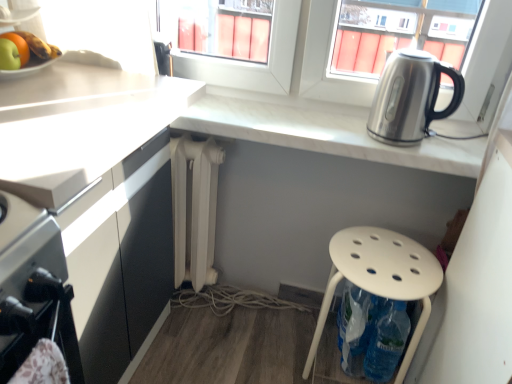
Question: Is the depth of white plastic stool at lower right less than that of green matte apple at upper left?

Choices:
 (A) yes
 (B) no

Answer: (B)

Question: Considering the relative sizes of white plastic stool at lower right and green matte apple at upper left in the image provided, is white plastic stool at lower right thinner than green matte apple at upper left?

Choices:
 (A) yes
 (B) no

Answer: (B)

Question: Can we say white plastic stool at lower right lies outside green matte apple at upper left?

Choices:
 (A) no
 (B) yes

Answer: (B)

Question: Is white plastic stool at lower right smaller than green matte apple at upper left?

Choices:
 (A) no
 (B) yes

Answer: (A)

Question: Is white plastic stool at lower right positioned with its back to green matte apple at upper left?

Choices:
 (A) yes
 (B) no

Answer: (B)

Question: Considering the relative positions of white plastic stool at lower right and green matte apple at upper left in the image provided, is white plastic stool at lower right behind green matte apple at upper left?

Choices:
 (A) yes
 (B) no

Answer: (A)

Question: Considering the relative positions of white marble countertop at upper right, marked as the 2th countertop in a left-to-right arrangement, and white matte countertop at left, which is the 1th countertop in left-to-right order, in the image provided, is white marble countertop at upper right, marked as the 2th countertop in a left-to-right arrangement, to the right of white matte countertop at left, which is the 1th countertop in left-to-right order, from the viewer's perspective?

Choices:
 (A) no
 (B) yes

Answer: (B)

Question: Is white marble countertop at upper right, the 1th countertop in the right-to-left sequence, not near white matte countertop at left, the 2th countertop when ordered from right to left?

Choices:
 (A) yes
 (B) no

Answer: (B)

Question: Is the position of white marble countertop at upper right, the 1th countertop in the right-to-left sequence, less distant than that of white matte countertop at left, the 2th countertop when ordered from right to left?

Choices:
 (A) no
 (B) yes

Answer: (A)

Question: Can you confirm if white marble countertop at upper right, the 1th countertop in the right-to-left sequence, is wider than white matte countertop at left, the 2th countertop when ordered from right to left?

Choices:
 (A) no
 (B) yes

Answer: (A)

Question: Does white marble countertop at upper right, marked as the 2th countertop in a left-to-right arrangement, have a smaller size compared to white matte countertop at left, which is the 1th countertop in left-to-right order?

Choices:
 (A) yes
 (B) no

Answer: (A)

Question: Would you say white marble countertop at upper right, marked as the 2th countertop in a left-to-right arrangement, is outside white matte countertop at left, the 2th countertop when ordered from right to left?

Choices:
 (A) yes
 (B) no

Answer: (A)

Question: Does green matte apple at upper left have a greater width compared to white matte radiator at center?

Choices:
 (A) no
 (B) yes

Answer: (A)